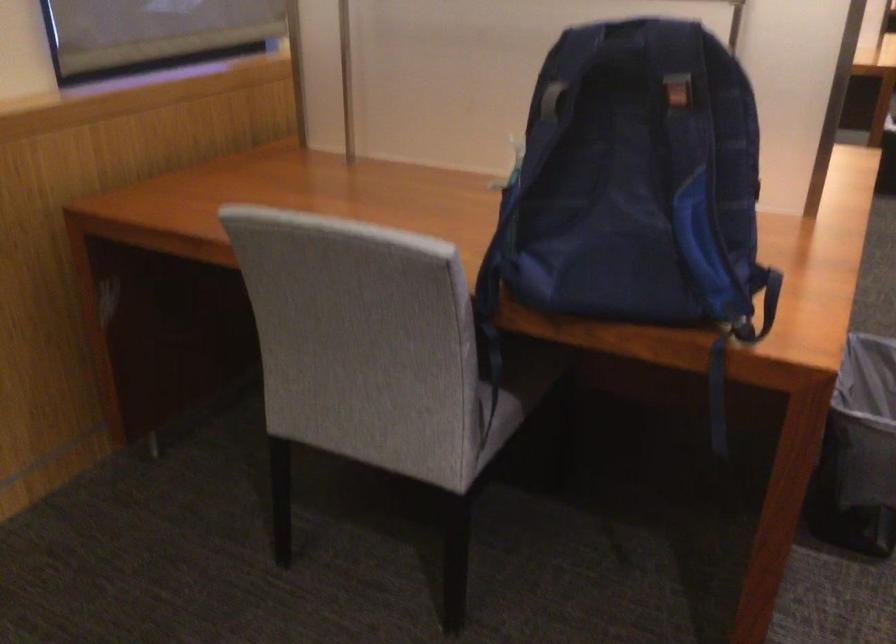
Describe the element at coordinates (677, 93) in the screenshot. Image resolution: width=896 pixels, height=644 pixels. I see `the backpack buckle` at that location.